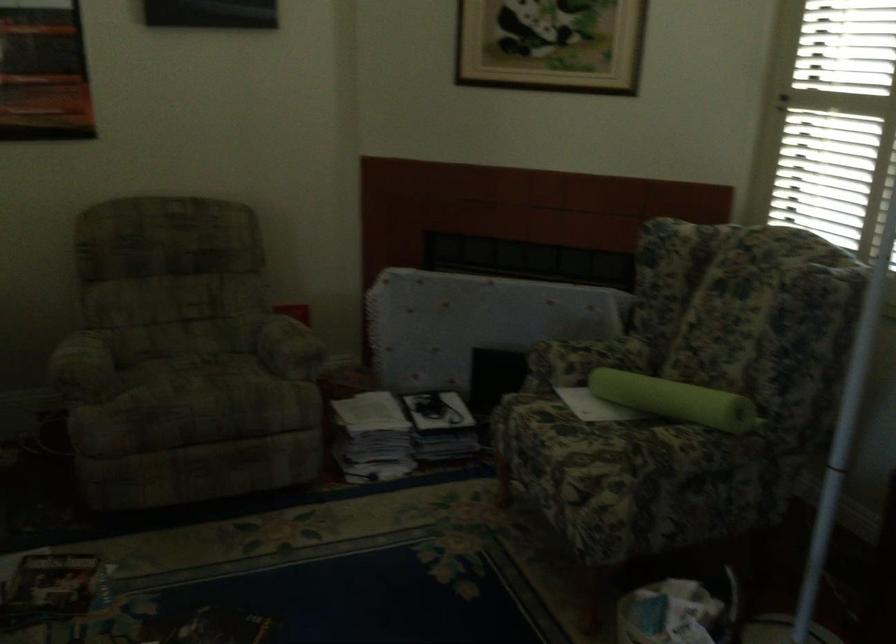
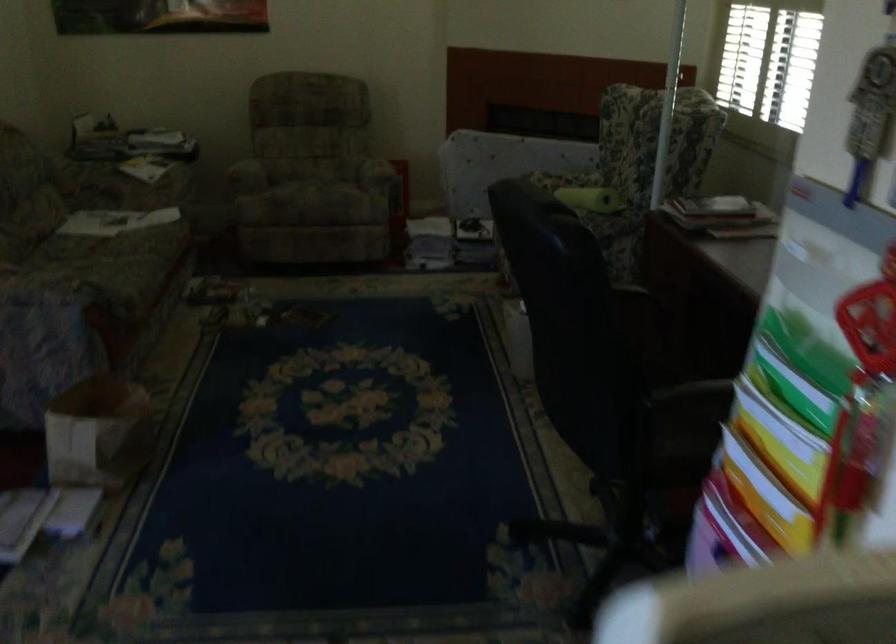
What movement of the cameraman would produce the second image?

The movement direction of the cameraman is right, backward.